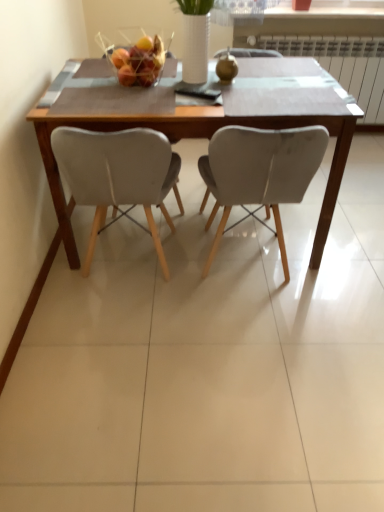
Question: From a real-world perspective, is wooden table at center physically located above or below matte gray chair at center, marked as the 2th chair in a left-to-right arrangement?

Choices:
 (A) above
 (B) below

Answer: (B)

Question: Choose the correct answer: Is wooden table at center inside matte gray chair at center, which is the 1th chair from right to left, or outside it?

Choices:
 (A) inside
 (B) outside

Answer: (B)

Question: Considering the real-world distances, which object is closest to the matte gray chair at center, marked as the 2th chair in a left-to-right arrangement?

Choices:
 (A) metallic wire basket at center
 (B) wooden table at center
 (C) white plastic radiator at upper right
 (D) matte gray chair at center, the first chair from the left

Answer: (B)

Question: Estimate the real-world distances between objects in this image. Which object is closer to the metallic wire basket at center?

Choices:
 (A) matte gray chair at center, which is counted as the 2th chair, starting from the right
 (B) white plastic radiator at upper right
 (C) wooden table at center
 (D) matte gray chair at center, marked as the 2th chair in a left-to-right arrangement

Answer: (C)